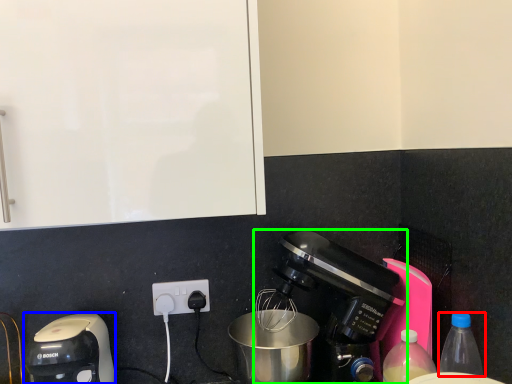
Question: Based on their relative distances, which object is nearer to bottle (highlighted by a red box)? Choose from coffee maker (highlighted by a blue box) and coffee maker (highlighted by a green box).

Choices:
 (A) coffee maker
 (B) coffee maker

Answer: (B)